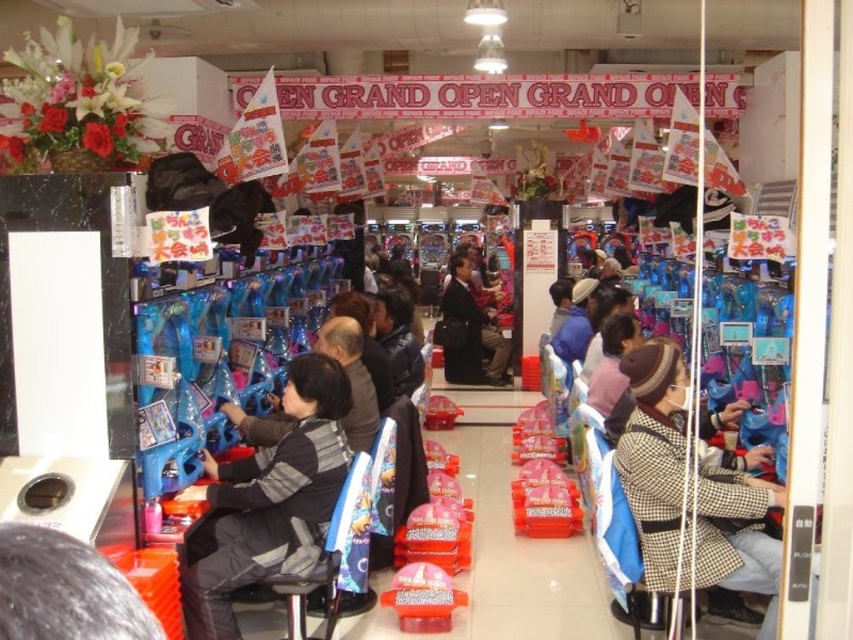
Based on the photo, is dark gray suit at center further to the viewer compared to leather jacket at center?

Yes, it is.

Describe the element at coordinates (469, 330) in the screenshot. I see `dark gray suit at center` at that location.

The height and width of the screenshot is (640, 853). I want to click on dark gray suit at center, so click(x=469, y=330).

Is gray fabric jacket at center to the left of dark gray suit at center from the viewer's perspective?

Correct, you'll find gray fabric jacket at center to the left of dark gray suit at center.

Locate an element on the screen. This screenshot has width=853, height=640. gray fabric jacket at center is located at coordinates (267, 500).

This screenshot has height=640, width=853. I want to click on gray fabric jacket at center, so click(x=267, y=500).

The height and width of the screenshot is (640, 853). Describe the element at coordinates (422, 598) in the screenshot. I see `rubberized plastic toy at center` at that location.

This screenshot has width=853, height=640. Find the location of `rubberized plastic toy at center`. rubberized plastic toy at center is located at coordinates (422, 598).

Identify the location of rubberized plastic toy at center. This screenshot has height=640, width=853. (422, 598).